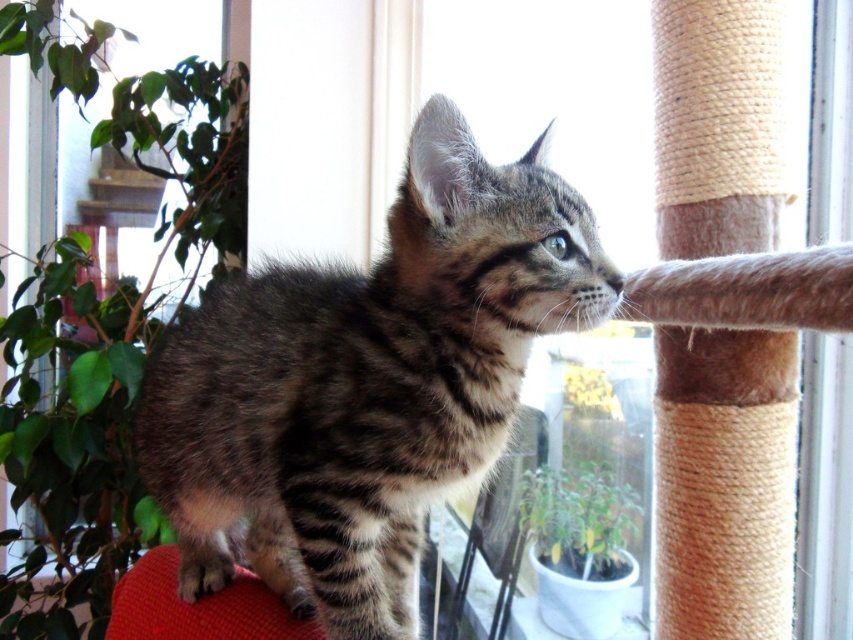
You are a cat owner who wants to place a new toy between the striped fur cat at center and the green leafy plant at left. Can you fit the toy there if it requires 1 meter of space?

The striped fur cat at center is 1.21 meters away from the green leafy plant at left, so yes, the toy can be placed between them since the distance is more than 1 meter.

You are a photographer standing in the room with the striped fur cat at center. You want to take a closeup photo of the cat without getting too close. If your camera has a zoom range of 200mm, can you capture the cat clearly from your current position?

The striped fur cat at center is 35.36 inches away from viewer. Since 35.36 inches is approximately 0.898 meters, a 200mm lens can effectively capture closeup details from that distance without needing to move closer. Yes, you can take the photo clearly.